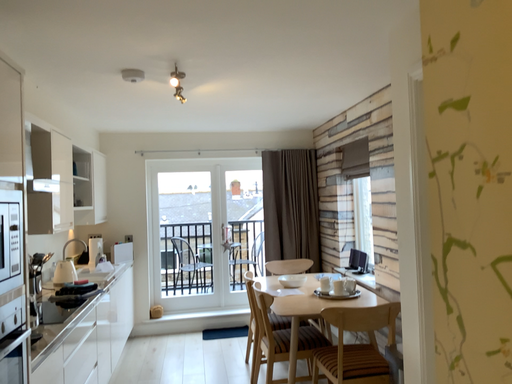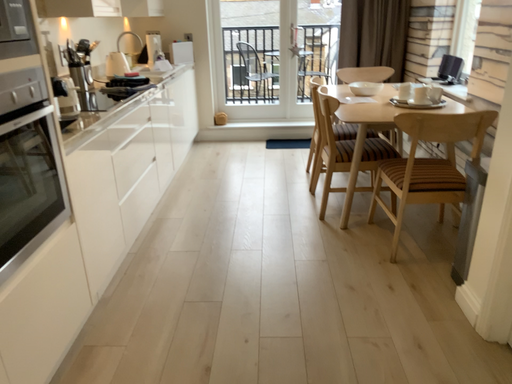
Question: How did the camera likely rotate when shooting the video?

Choices:
 (A) rotated right
 (B) rotated left

Answer: (B)